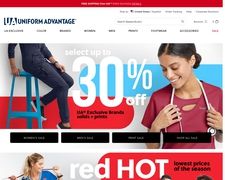
Locate an element on the screen. This screenshot has width=225, height=180. stool is located at coordinates (25, 113).